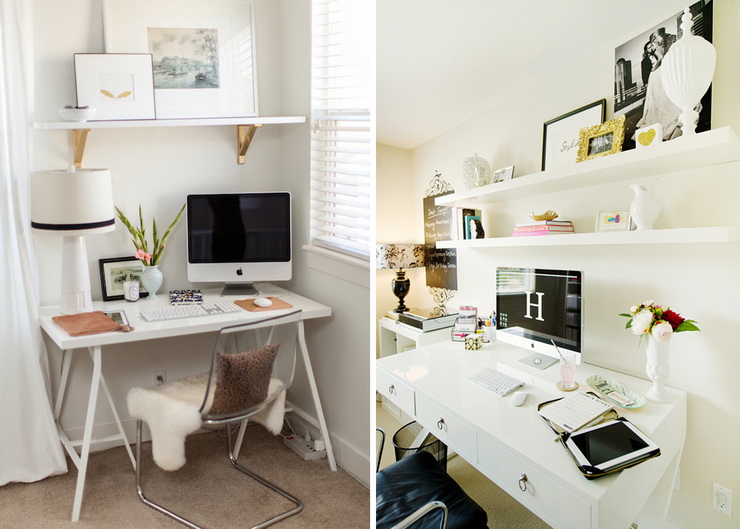
Find the location of `table`. table is located at coordinates tap(144, 320).